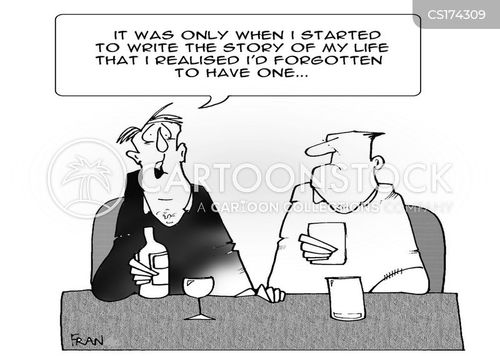
Find the location of a particular element. The width and height of the screenshot is (500, 356). wine bottle is located at coordinates 160,251.